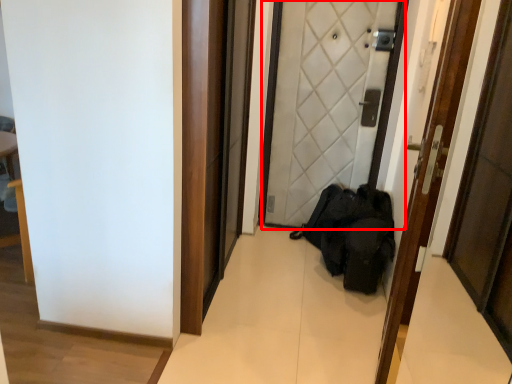
Question: From the image's perspective, what is the correct spatial positioning of door (annotated by the red box) in reference to door?

Choices:
 (A) below
 (B) above

Answer: (B)